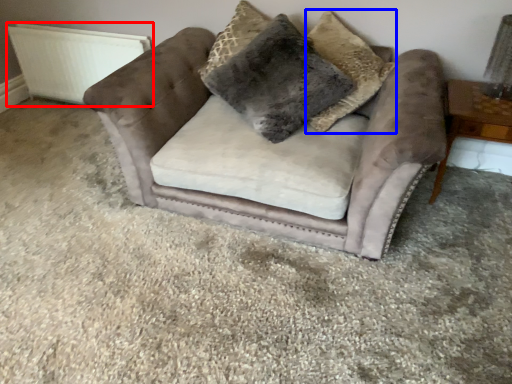
Question: Which object appears closest to the camera in this image, radiator (highlighted by a red box) or pillow (highlighted by a blue box)?

Choices:
 (A) radiator
 (B) pillow

Answer: (B)